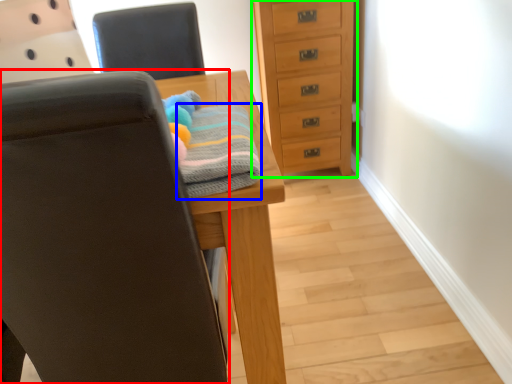
Question: Which object is positioned closest to chair (highlighted by a red box)? Select from bath towel (highlighted by a blue box) and chest of drawers (highlighted by a green box).

Choices:
 (A) bath towel
 (B) chest of drawers

Answer: (A)